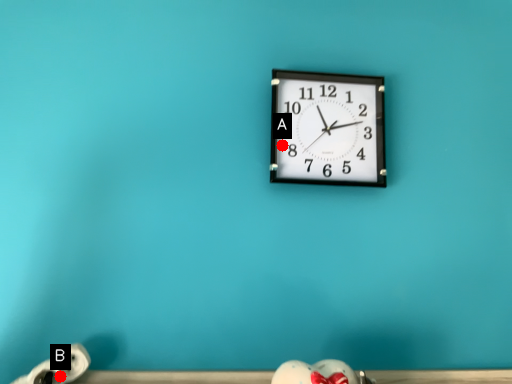
Question: Two points are circled on the image, labeled by A and B beside each circle. Which of the following is the farthest from the observer?

Choices:
 (A) A is further
 (B) B is further

Answer: (A)